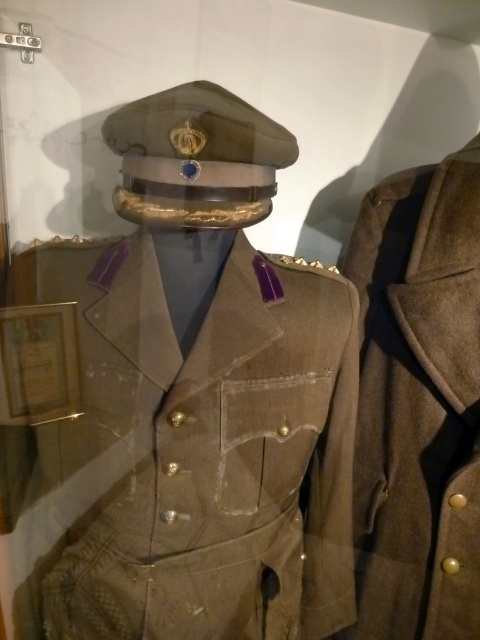
Looking at this image, you are a museum security guard standing at the entrance of the exhibit hall. You need to ensure the matte brown uniform at center is visible to all visitors. Based on its position, where should you position the spotlight to best illuminate it?

The matte brown uniform at center is located at point 0.630 on the x axis and 0.373 on the y axis, so the spotlight should be positioned directly above or facing that coordinate to ensure proper illumination.

You are a museum visitor standing in front of the glass case. You want to take a photo of the matte brown uniform at center. If your camera can focus on objects up to 25 inches away, will you need to step back to take a clear photo?

The matte brown uniform at center is 26.38 inches from the viewer. Since your camera can focus up to 25 inches away, you need to step back to ensure the camera can focus properly.

You are a museum visitor standing in front of the glass case. You notice the matte brown uniform at center and the brown wool coat at right. Which object is closer to you, the visitor?

The matte brown uniform at center is closer to you because it is in front of the brown wool coat at right.